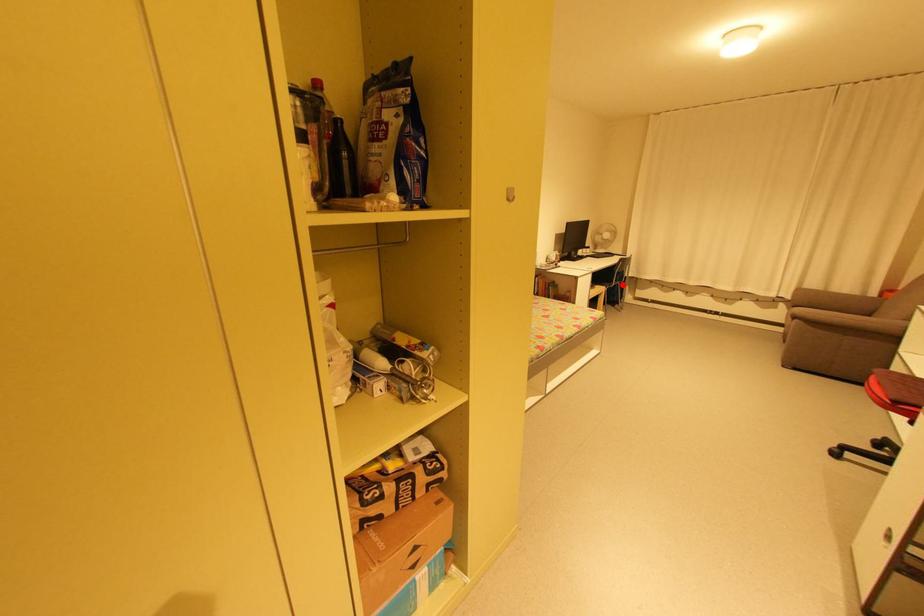
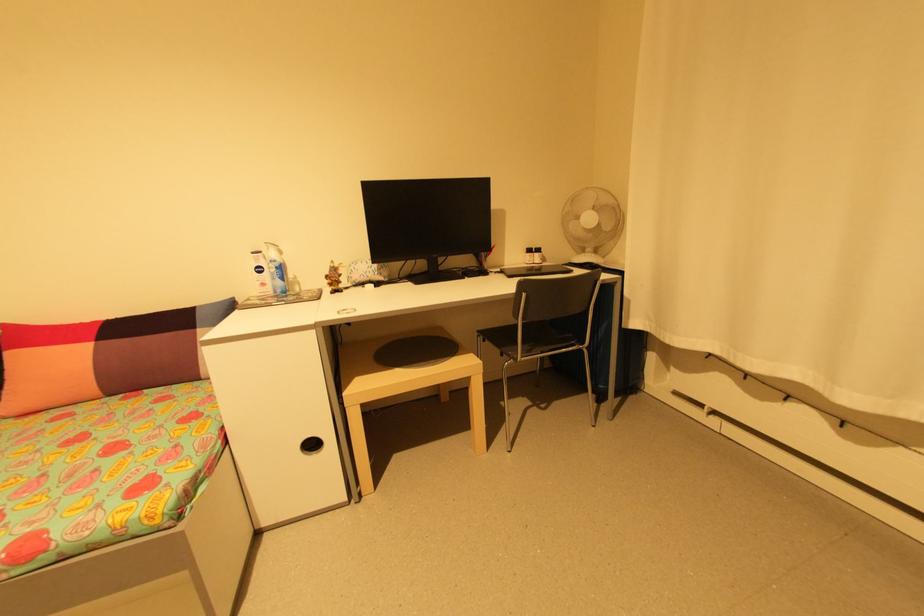
In the second image, find the point that corresponds to the highlighted location in the first image.

(585, 352)